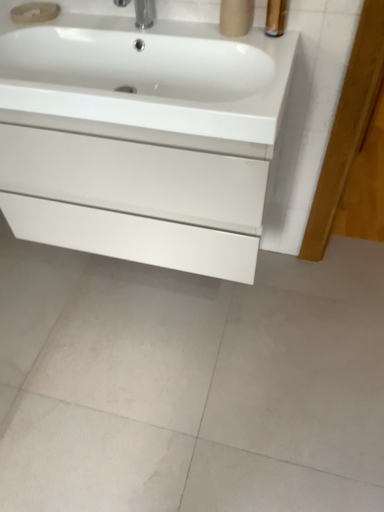
Where is `vacant space underneath white glossy cabinet at center (from a real-world perspective)`? vacant space underneath white glossy cabinet at center (from a real-world perspective) is located at coordinates (155, 283).